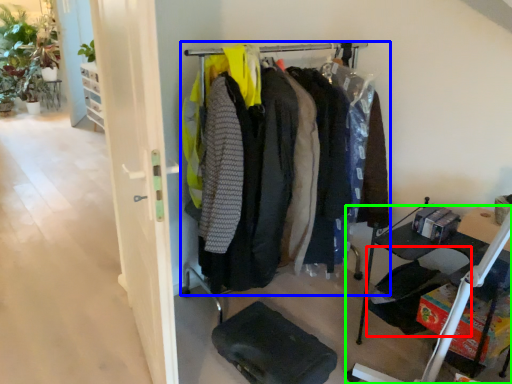
Question: Which object is positioned closest to folding chair (highlighted by a red box)? Select from closet (highlighted by a blue box) and furniture (highlighted by a green box).

Choices:
 (A) closet
 (B) furniture

Answer: (B)